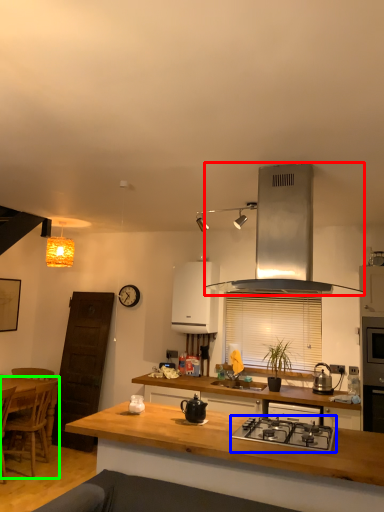
Question: Which object is the farthest from kitchen appliance (highlighted by a red box)? Choose among these: gas stove (highlighted by a blue box) or chair (highlighted by a green box).

Choices:
 (A) gas stove
 (B) chair

Answer: (B)